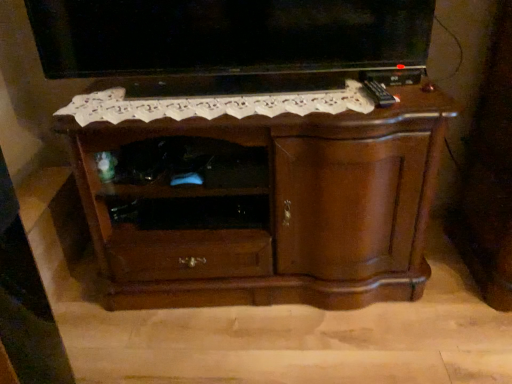
Question: Is matte black tv at upper center next to shiny brown cabinet at center?

Choices:
 (A) yes
 (B) no

Answer: (B)

Question: From a real-world perspective, is matte black tv at upper center located higher than shiny brown cabinet at center?

Choices:
 (A) no
 (B) yes

Answer: (B)

Question: From a real-world perspective, is matte black tv at upper center beneath shiny brown cabinet at center?

Choices:
 (A) no
 (B) yes

Answer: (A)

Question: Would you say matte black tv at upper center is outside shiny brown cabinet at center?

Choices:
 (A) no
 (B) yes

Answer: (B)

Question: Considering the relative sizes of matte black tv at upper center and shiny brown cabinet at center in the image provided, is matte black tv at upper center shorter than shiny brown cabinet at center?

Choices:
 (A) no
 (B) yes

Answer: (B)

Question: Is matte black tv at upper center turned away from shiny brown cabinet at center?

Choices:
 (A) yes
 (B) no

Answer: (B)

Question: Does shiny brown cabinet at center appear on the right side of matte black tv at upper center?

Choices:
 (A) no
 (B) yes

Answer: (B)

Question: From the image's perspective, does shiny brown cabinet at center appear lower than matte black tv at upper center?

Choices:
 (A) no
 (B) yes

Answer: (B)

Question: Is shiny brown cabinet at center aimed at matte black tv at upper center?

Choices:
 (A) no
 (B) yes

Answer: (A)

Question: Does shiny brown cabinet at center have a greater height compared to matte black tv at upper center?

Choices:
 (A) no
 (B) yes

Answer: (B)

Question: Is shiny brown cabinet at center shorter than matte black tv at upper center?

Choices:
 (A) no
 (B) yes

Answer: (A)

Question: Does shiny brown cabinet at center come behind matte black tv at upper center?

Choices:
 (A) yes
 (B) no

Answer: (B)

Question: Is matte black tv at upper center bigger or smaller than shiny brown cabinet at center?

Choices:
 (A) big
 (B) small

Answer: (B)